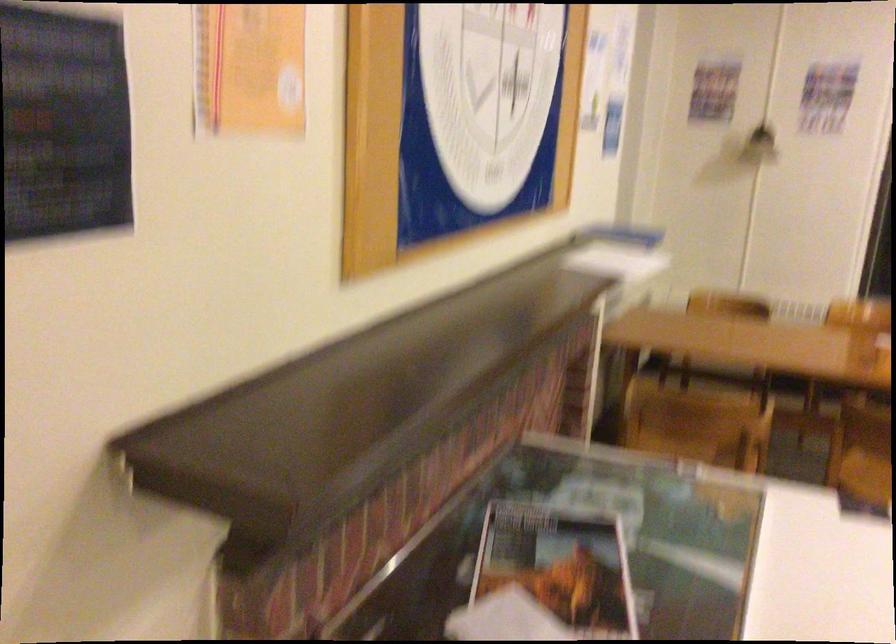
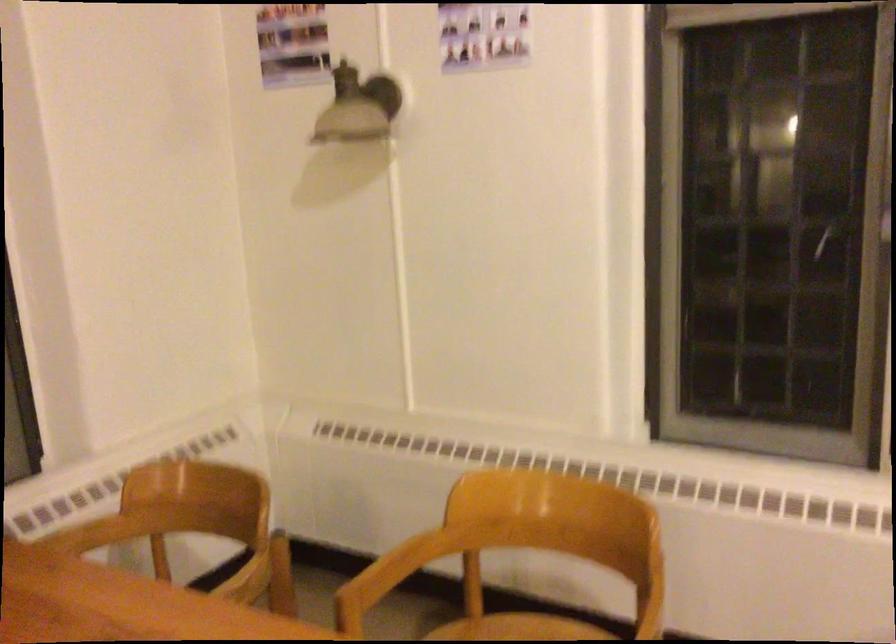
In the second image, find the point that corresponds to pixel 652 301 in the first image.

(92, 534)